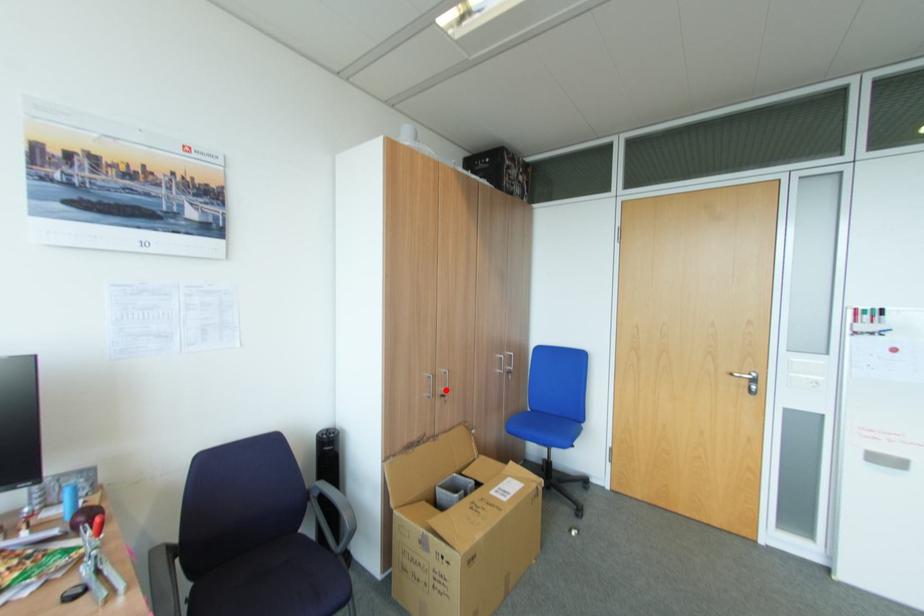
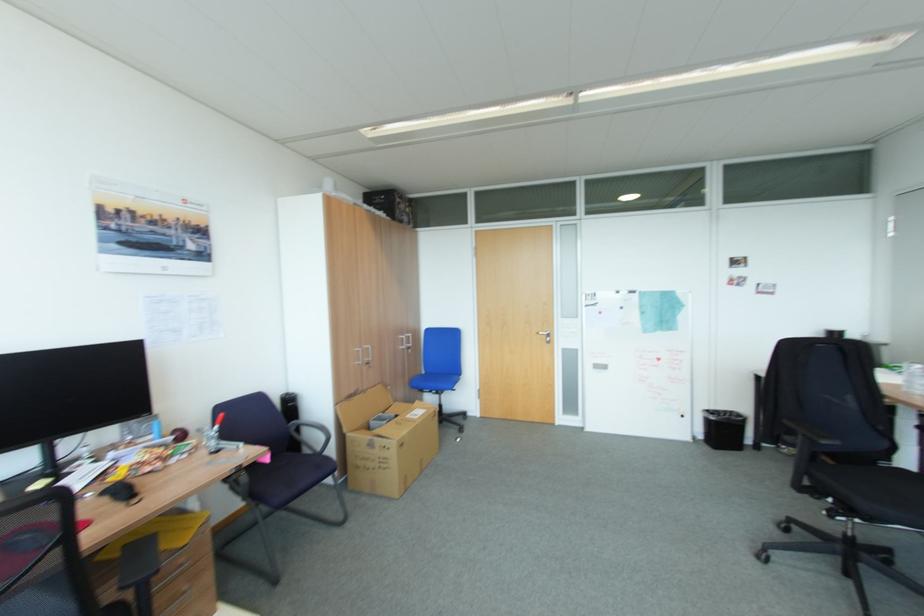
Where in the second image is the point corresponding to the highlighted location from the first image?

(371, 360)